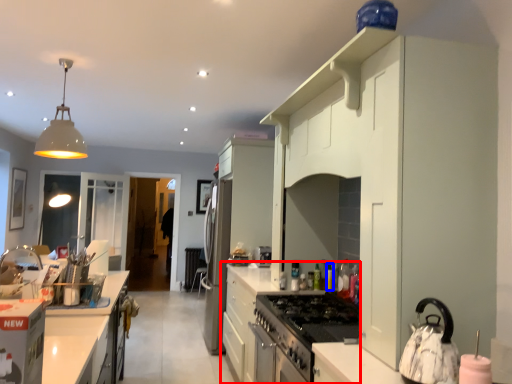
Question: Among these objects, which one is nearest to the camera, cabinetry (highlighted by a red box) or bottle (highlighted by a blue box)?

Choices:
 (A) cabinetry
 (B) bottle

Answer: (A)